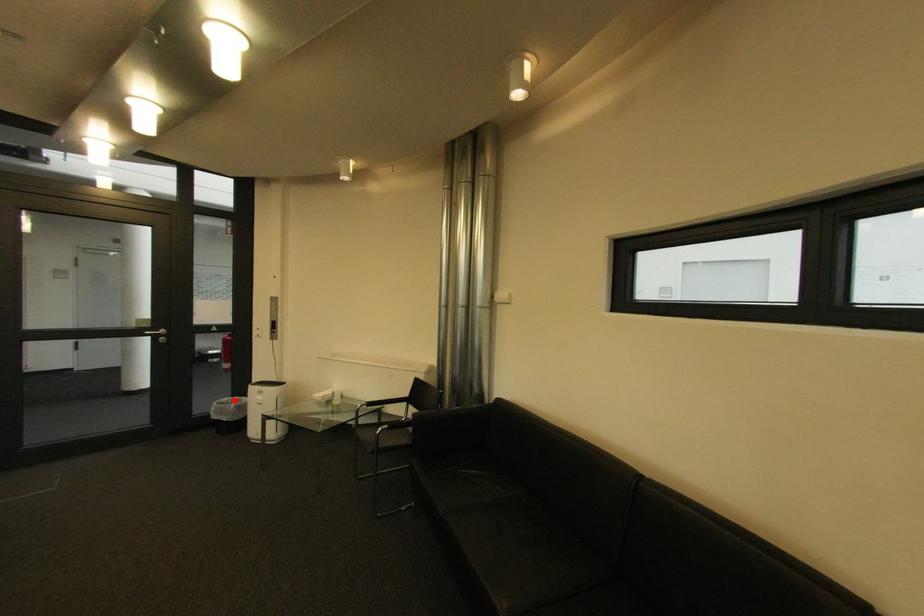
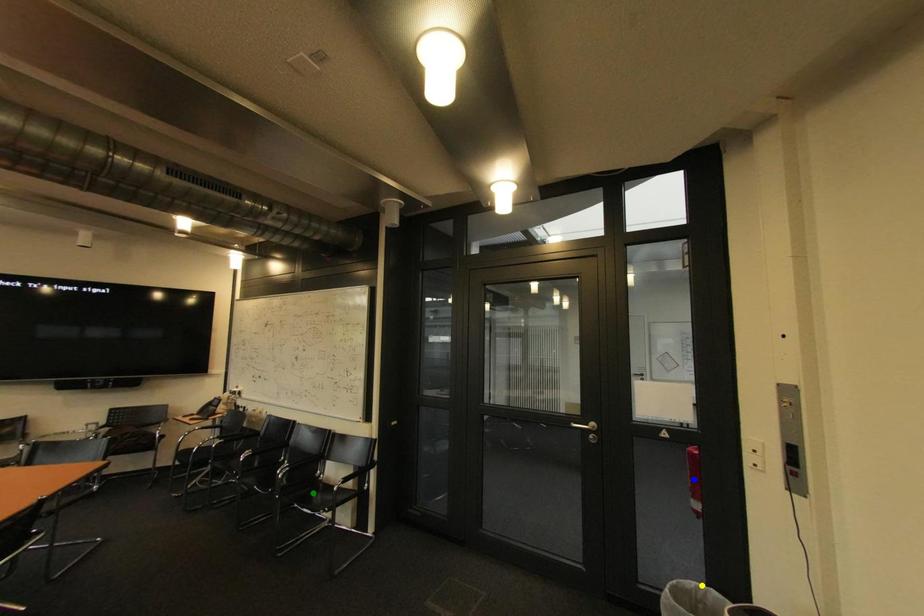
Question: I am providing you with two images of the same scene from different viewpoints. A red point is marked on the first image. You are given multiple points on the second image. Which spot in image 2 lines up with the point in image 1?

Choices:
 (A) yellow point
 (B) blue point
 (C) green point

Answer: (A)